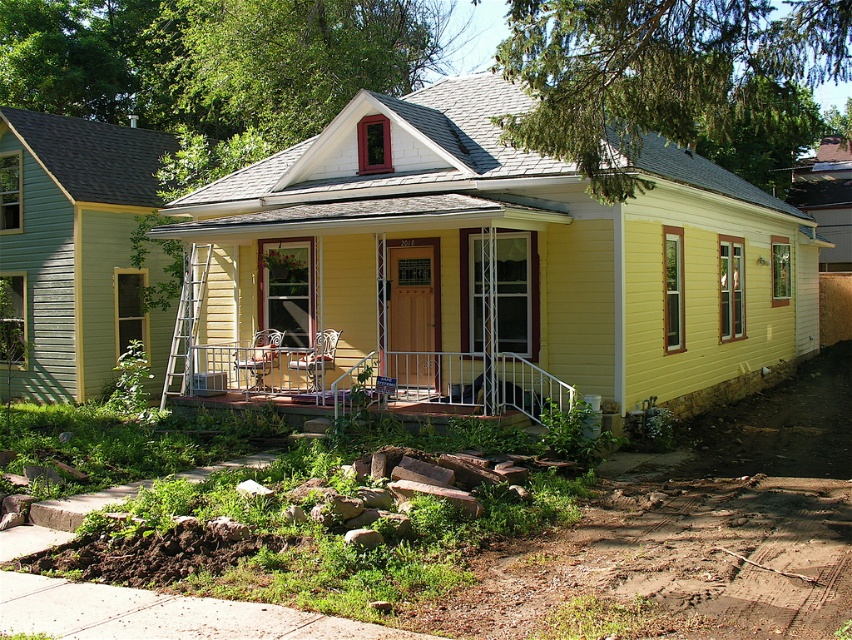
Question: Which point is farther from the camera taking this photo?

Choices:
 (A) (187, 353)
 (B) (252, 387)

Answer: (B)

Question: Which point appears closest to the camera in this image?

Choices:
 (A) (242, 352)
 (B) (219, 365)
 (C) (196, 282)

Answer: (C)

Question: Which of the following is the closest to the observer?

Choices:
 (A) (177, 344)
 (B) (551, 404)

Answer: (B)

Question: Observing the image, what is the correct spatial positioning of metallic white railing at center in reference to metallic silver rocking chair at center?

Choices:
 (A) below
 (B) above

Answer: (A)

Question: From the image, what is the correct spatial relationship of metallic white railing at center in relation to silver metallic ladder at lower left?

Choices:
 (A) left
 (B) right

Answer: (B)

Question: Does silver metallic ladder at lower left appear on the left side of metallic silver rocking chair at center?

Choices:
 (A) no
 (B) yes

Answer: (B)